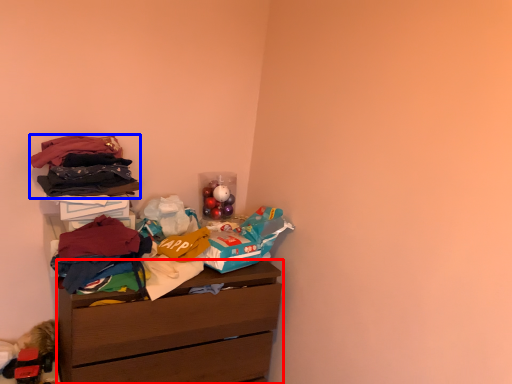
Question: Which object is closer to the camera taking this photo, chest of drawers (highlighted by a red box) or clothing (highlighted by a blue box)?

Choices:
 (A) chest of drawers
 (B) clothing

Answer: (A)